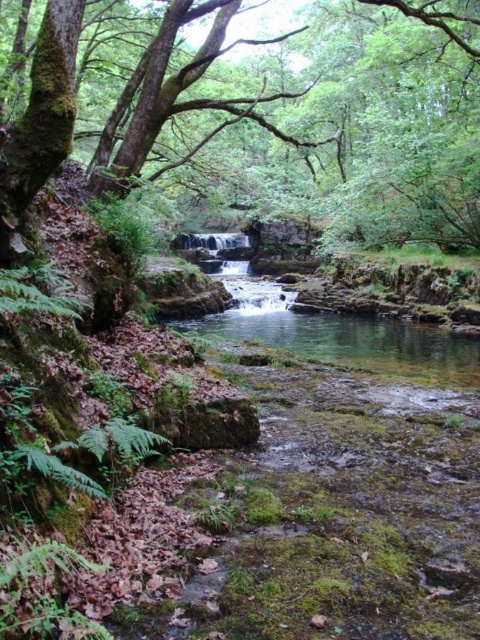
Which of these two, green mossy tree at upper left or clear water at center, stands taller?

With more height is green mossy tree at upper left.

Is green mossy tree at upper left positioned behind clear water at center?

No, green mossy tree at upper left is closer to the viewer.

You are a GUI agent. You are given a task and a screenshot of the screen. Output one action in this format:
    pyautogui.click(x=<x>, y=<y>)
    Task: Click on the green mossy tree at upper left
    The width and height of the screenshot is (480, 640).
    Given the screenshot: What is the action you would take?
    pyautogui.click(x=276, y=116)